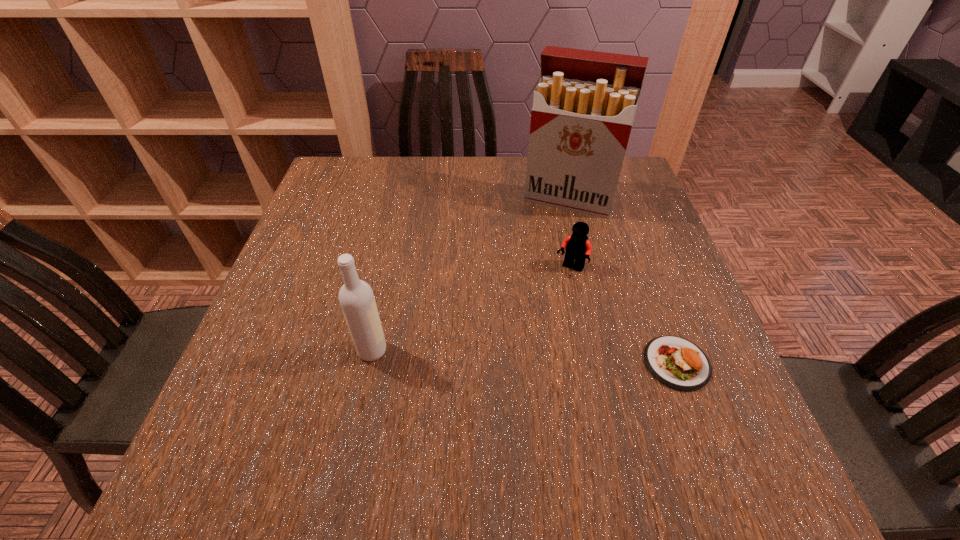
Locate an element on the screen. The width and height of the screenshot is (960, 540). vacant space on the desktop that is between the second tallest object and the shortest object and is positioned on the front-facing side of the second farthest object is located at coordinates (514, 356).

I want to click on free spot on the desktop that is between the third shortest object and the patty (food) and is positioned with the lid open on the tallest object, so click(x=512, y=356).